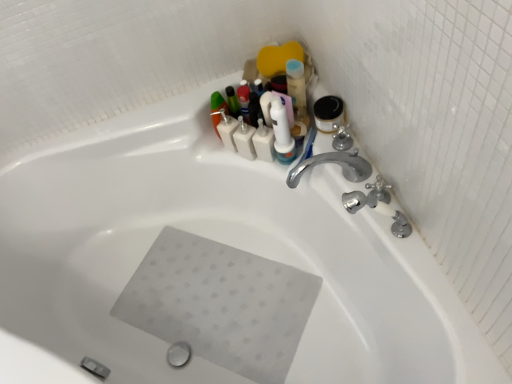
The image size is (512, 384). What are the coordinates of `free space in front of satin nickel faucet at upper right, the 1th plumbing fixture when ordered from back to front` in the screenshot? It's located at tap(407, 240).